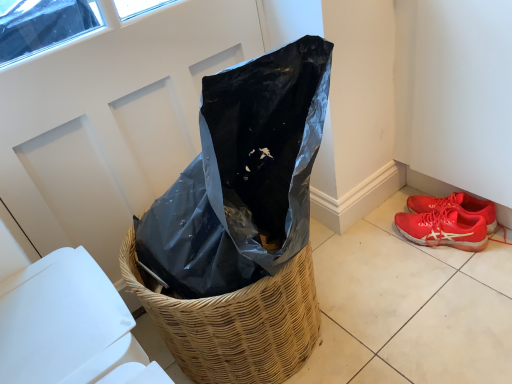
What are the coordinates of `free spot below shiny red sneakers at lower right (from a real-world perspective)` in the screenshot? It's located at click(x=443, y=248).